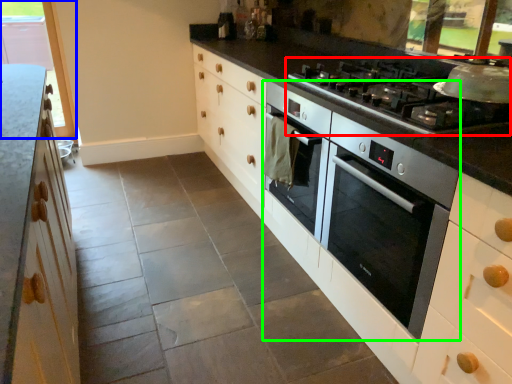
Question: Which is farther away from gas stove (highlighted by a red box)? window (highlighted by a blue box) or home appliance (highlighted by a green box)?

Choices:
 (A) window
 (B) home appliance

Answer: (A)